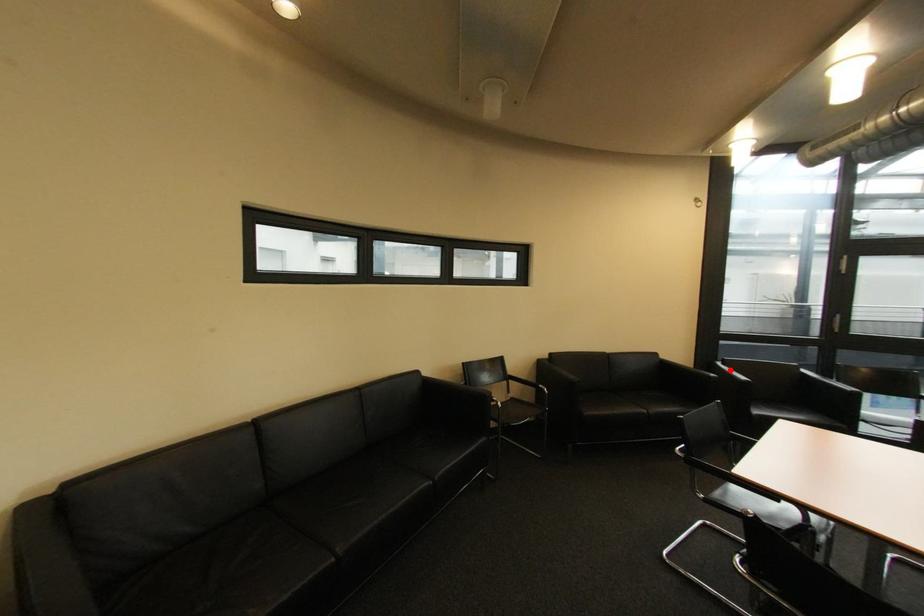
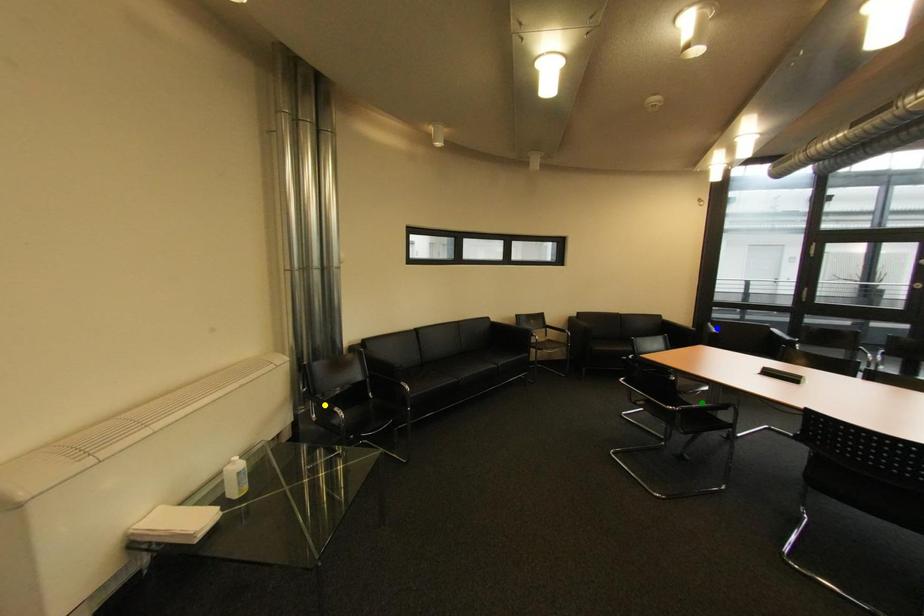
Question: I am providing you with two images of the same scene from different viewpoints. A red point is marked on the first image. You are given multiple points on the second image. Which mark in image 2 goes with the point in image 1?

Choices:
 (A) blue point
 (B) yellow point
 (C) green point

Answer: (A)